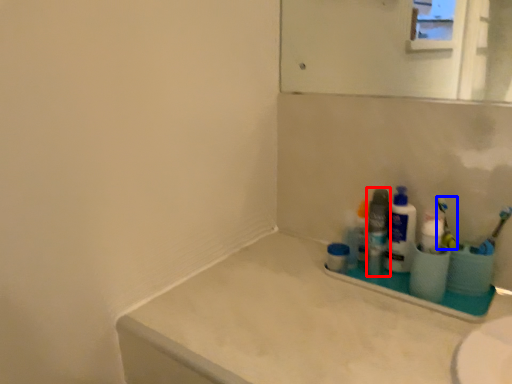
Question: Which object is closer to the camera taking this photo, toiletry (highlighted by a red box) or toothbrush (highlighted by a blue box)?

Choices:
 (A) toiletry
 (B) toothbrush

Answer: (B)